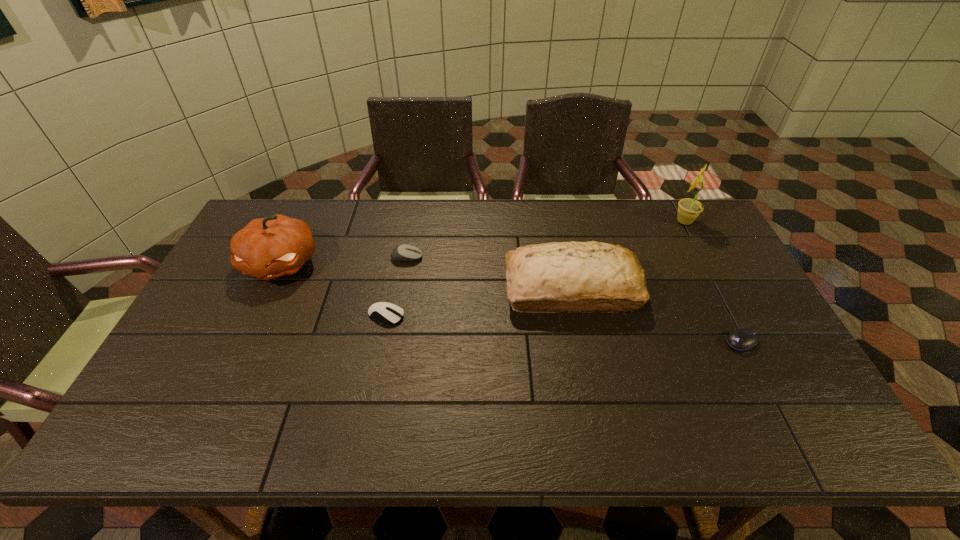
Identify the location of free space located 0.240m on the face of the sunflower. Image resolution: width=960 pixels, height=540 pixels. (603, 221).

Image resolution: width=960 pixels, height=540 pixels. Find the location of `vacant space located 0.330m on the face of the sunflower`. vacant space located 0.330m on the face of the sunflower is located at coordinates (577, 221).

Where is `vacant space positioned on the face of the sunflower`? The width and height of the screenshot is (960, 540). vacant space positioned on the face of the sunflower is located at coordinates (609, 221).

Where is `vacant space situated on the front face of the leftmost object`? vacant space situated on the front face of the leftmost object is located at coordinates pos(222,389).

In order to click on free space located 0.090m on the left of the bread in this screenshot , I will do `click(474, 289)`.

Find the location of a particular element. The image size is (960, 540). free spot located 0.090m on the wheel side of the farthest computer mouse is located at coordinates (451, 258).

I want to click on vacant area situated on the left of the second nearest computer mouse, so click(x=303, y=315).

This screenshot has width=960, height=540. In order to click on free space located on the back of the shortest computer mouse in this screenshot , I will do `click(709, 279)`.

The width and height of the screenshot is (960, 540). What are the coordinates of `sunflower that is at the far edge` in the screenshot? It's located at (689, 209).

You are a GUI agent. You are given a task and a screenshot of the screen. Output one action in this format:
    pyautogui.click(x=<x>, y=<y>)
    Task: Click on the pumpkin located in the far edge section of the desktop
    This screenshot has width=960, height=540.
    Given the screenshot: What is the action you would take?
    pyautogui.click(x=267, y=248)